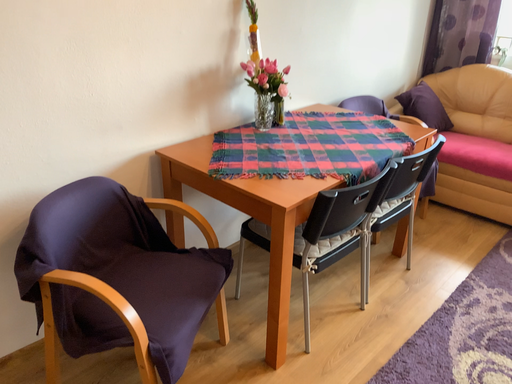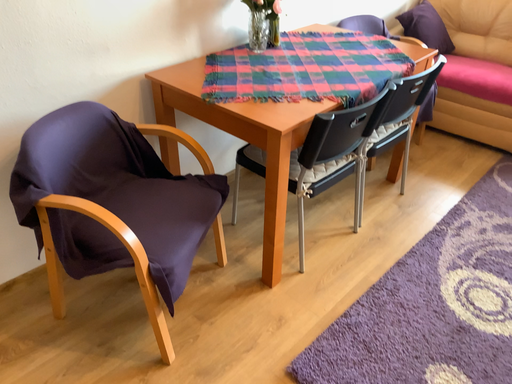
Question: Which way did the camera rotate in the video?

Choices:
 (A) rotated upward
 (B) rotated downward

Answer: (B)